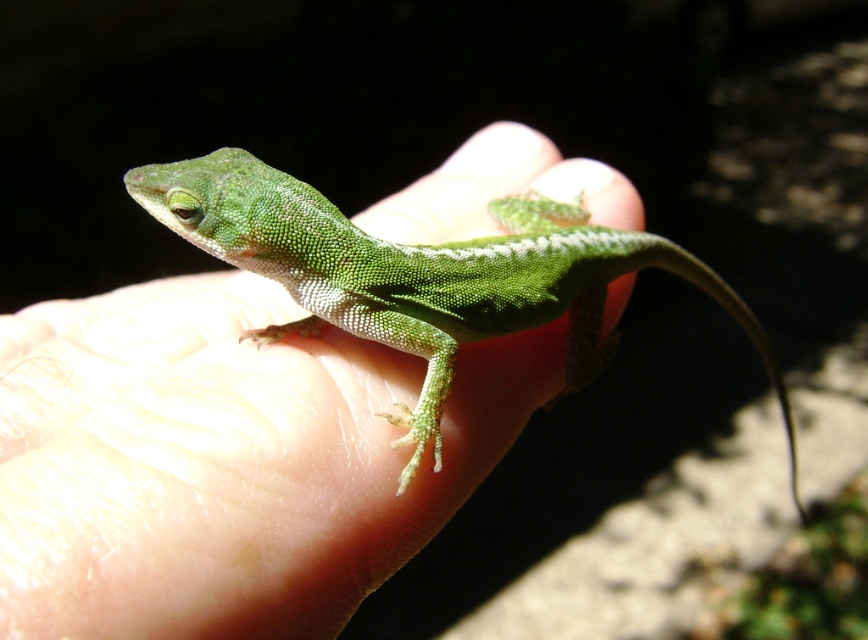
You are a photographer trying to capture the green matte lizard at center and the green matte tail at center in a closeup shot. Which object should you focus on if you want the larger one to be in sharp focus?

The green matte lizard at center is bigger than the green matte tail at center, so you should focus on the green matte lizard at center to ensure the larger one is in sharp focus.

You are a photographer trying to capture a closeup of the green matte lizard at center and the green matte tail at center. Which part of the lizard should you focus on to ensure the tail is in sharp focus?

The green matte lizard at center is closer to the viewer than the green matte tail at center. To ensure the tail is in sharp focus, you should focus on the green matte tail at center.

You are a photographer trying to capture the lizard and its tail in focus. Since the green matte lizard at center and the green matte tail at center are both in the scene, which one is closer to the camera?

The green matte lizard at center is positioned under the green matte tail at center, so the tail is closer to the camera than the lizard.